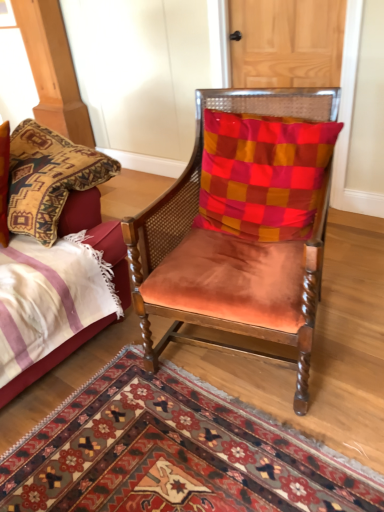
Question: From a real-world perspective, relative to suede orange chair at center, is checkered fabric pillow at center vertically above or below?

Choices:
 (A) below
 (B) above

Answer: (B)

Question: Is checkered fabric pillow at center situated inside suede orange chair at center or outside?

Choices:
 (A) outside
 (B) inside

Answer: (B)

Question: Considering the real-world distances, which object is closest to the wooden door at upper center?

Choices:
 (A) carpet with intricate patterns at center
 (B) checkered fabric pillow at center
 (C) suede orange chair at center
 (D) velvet bed at left

Answer: (B)

Question: Considering the real-world distances, which object is closest to the wooden door at upper center?

Choices:
 (A) suede orange chair at center
 (B) checkered fabric pillow at center
 (C) carpet with intricate patterns at center
 (D) velvet bed at left

Answer: (B)